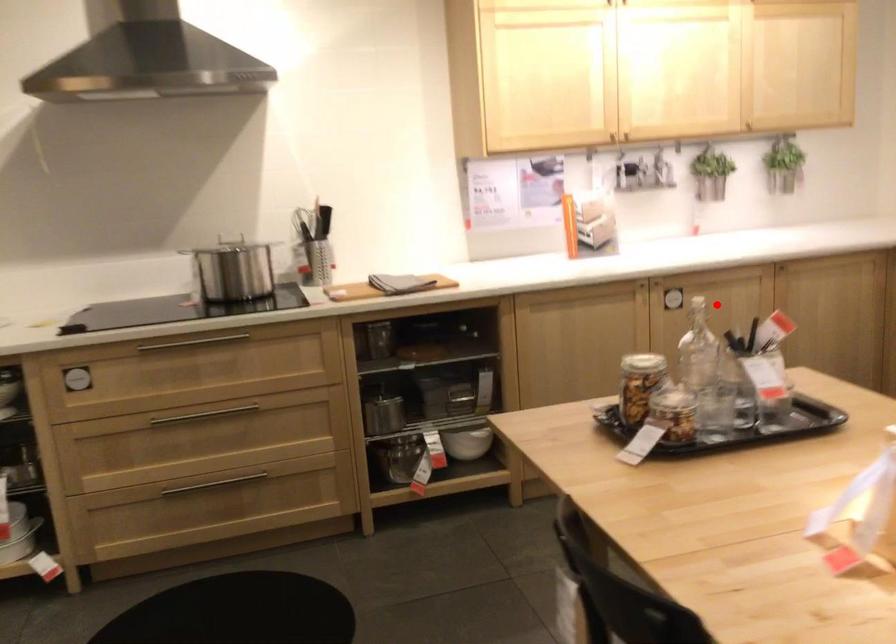
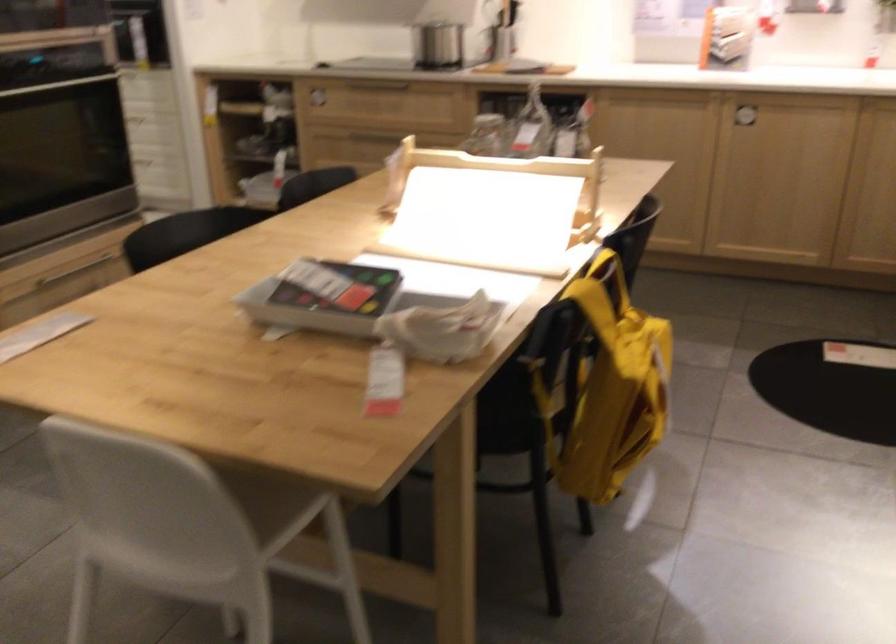
The point at the highlighted location is marked in the first image. Where is the corresponding point in the second image?

(745, 118)